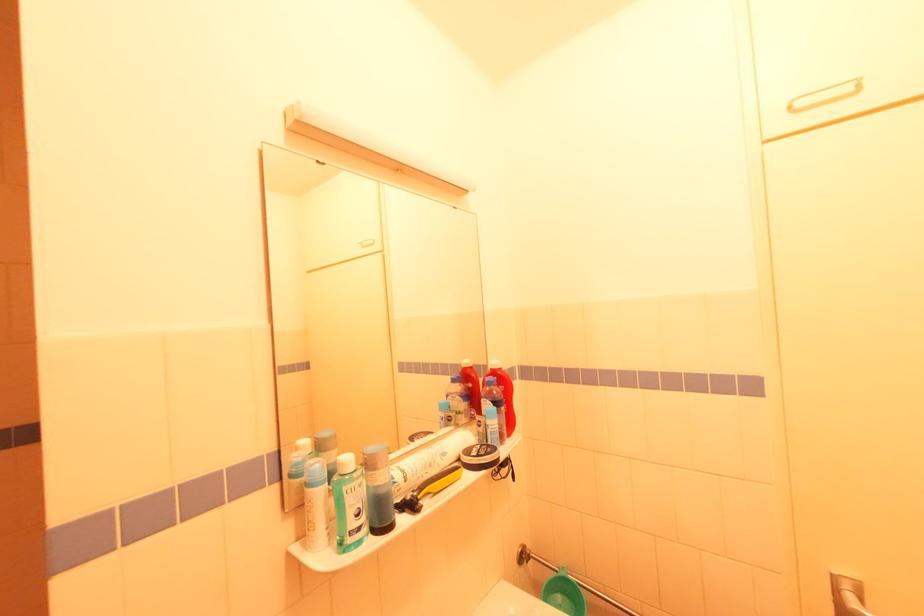
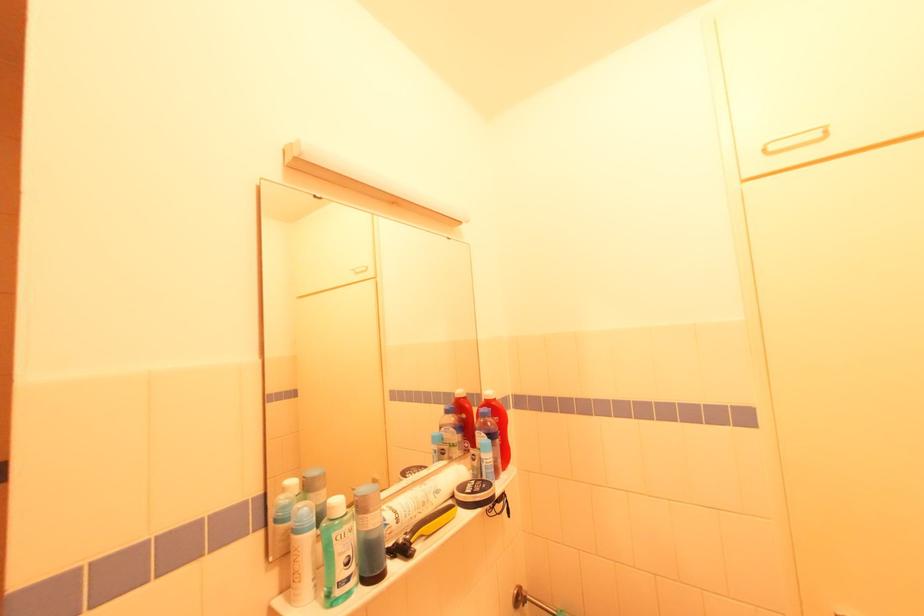
Locate, in the second image, the point that corresponds to [350,493] in the first image.

(341, 539)